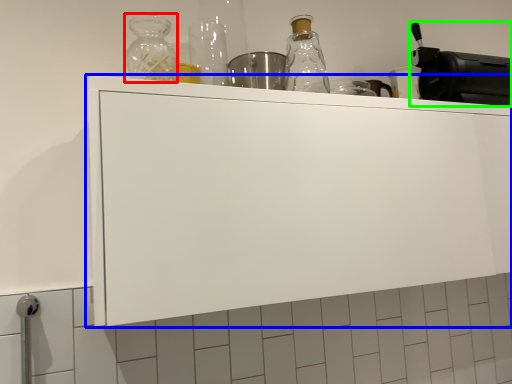
Question: Which object is the closest to the bottle (highlighted by a red box)? Choose among these: cabinetry (highlighted by a blue box) or appliance (highlighted by a green box).

Choices:
 (A) cabinetry
 (B) appliance

Answer: (A)